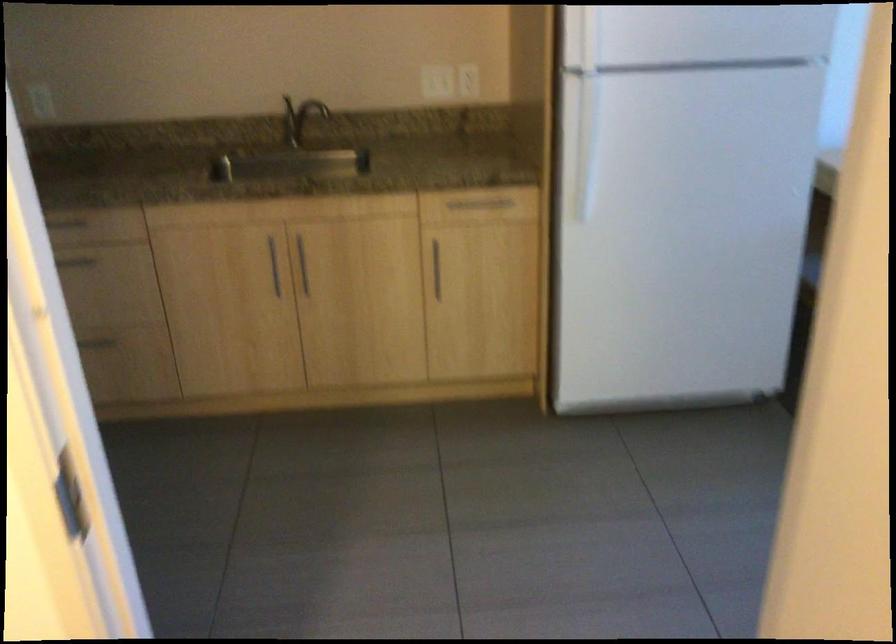
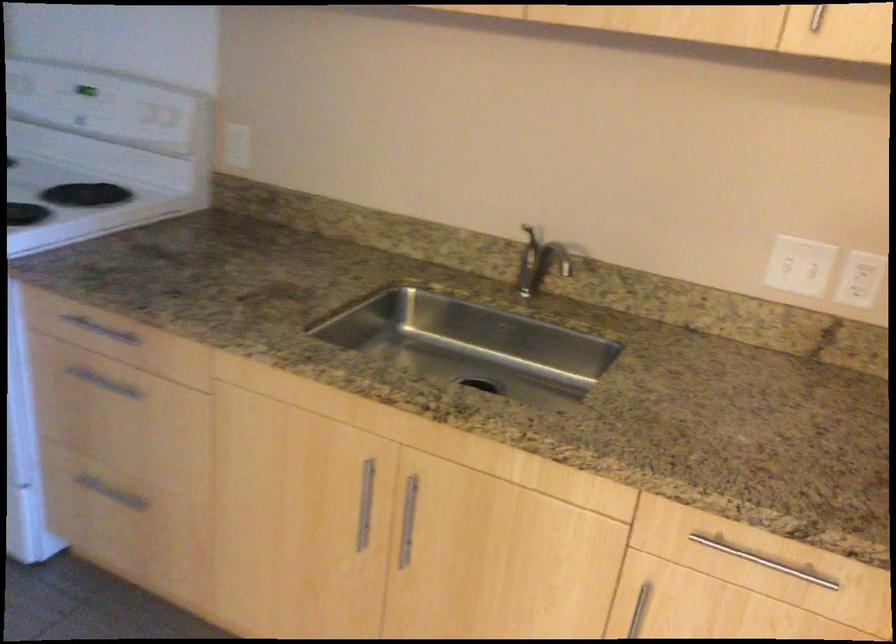
The point at (305, 269) is marked in the first image. Where is the corresponding point in the second image?

(408, 520)